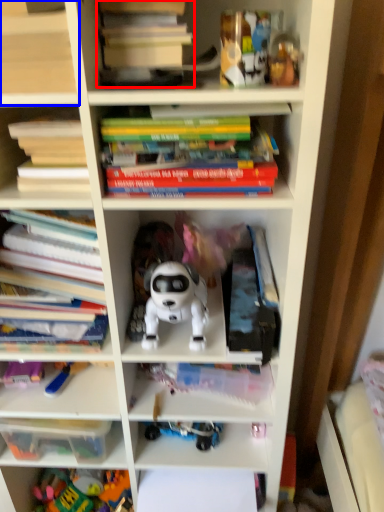
Question: Which of the following is the closest to the observer, book (highlighted by a red box) or shelf (highlighted by a blue box)?

Choices:
 (A) book
 (B) shelf

Answer: (B)